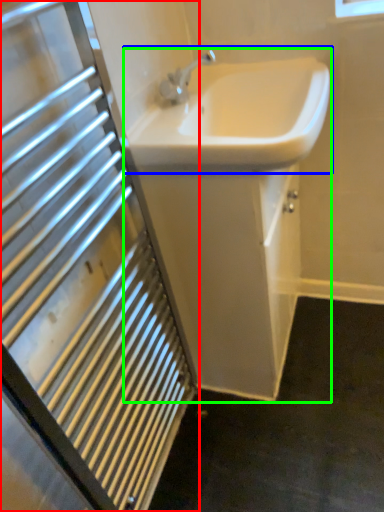
Question: Estimate the real-world distances between objects in this image. Which object is farther from bathroom cabinet (highlighted by a red box), sink (highlighted by a blue box) or sink (highlighted by a green box)?

Choices:
 (A) sink
 (B) sink

Answer: (A)